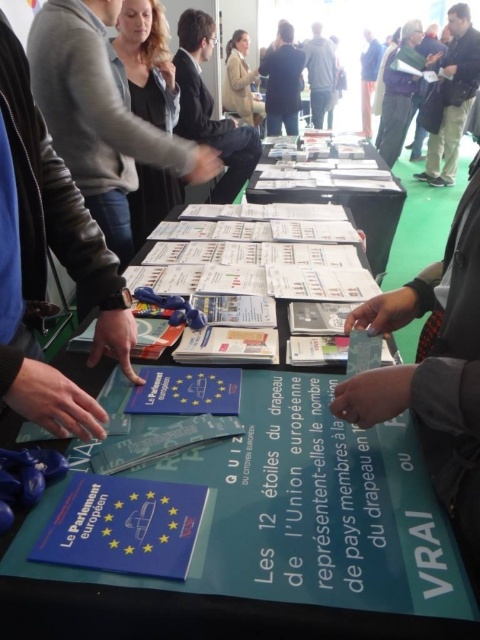
Question: Which object is positioned farthest from the leather jacket at center?

Choices:
 (A) gray fabric jacket at upper center
 (B) blue fabric jacket at upper center
 (C) black fabric jacket at upper center
 (D) dark suit at center

Answer: (B)

Question: From the image, what is the correct spatial relationship of gray wool sweater at upper right in relation to blue fabric jacket at upper center?

Choices:
 (A) left
 (B) right

Answer: (A)

Question: Is dark blue jeans at right below gray fabric jacket at upper center?

Choices:
 (A) yes
 (B) no

Answer: (A)

Question: Observing the image, what is the correct spatial positioning of leather jacket at center in reference to dark gray sweater at upper left?

Choices:
 (A) above
 (B) below

Answer: (B)

Question: Which object is farther from the camera taking this photo?

Choices:
 (A) dark blue jeans at right
 (B) white paper at center
 (C) leather jacket at center

Answer: (A)

Question: Which object appears closest to the camera in this image?

Choices:
 (A) dark blue jeans at right
 (B) dark suit at center

Answer: (B)